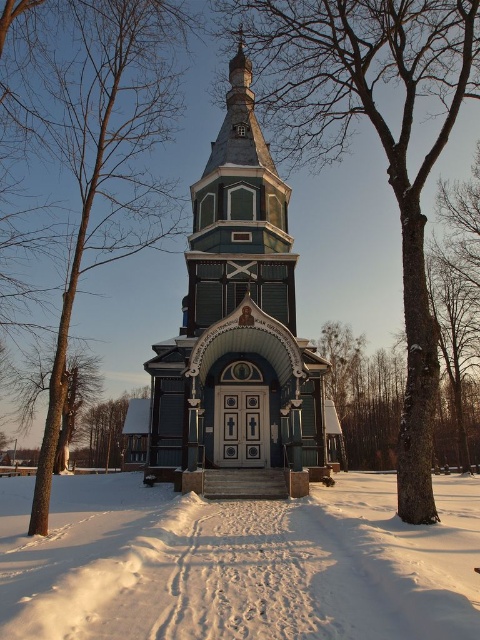
Question: Which point is farther from the camera taking this photo?

Choices:
 (A) (111, 240)
 (B) (327, 44)

Answer: (A)

Question: Is green wood tree at center wider than green wood tree at lower left?

Choices:
 (A) yes
 (B) no

Answer: (A)

Question: Which object is farther from the camera taking this photo?

Choices:
 (A) green wood tree at center
 (B) green wood tree at lower left
 (C) brown wood tree at center

Answer: (B)

Question: Is dark green wood church at center above green wood tree at center?

Choices:
 (A) no
 (B) yes

Answer: (A)

Question: Which of the following is the closest to the observer?

Choices:
 (A) (406, 424)
 (B) (204, 484)
 (C) (132, 420)
 (D) (84, 177)

Answer: (A)

Question: Is green wood tree at center positioned behind brown wood tree at center?

Choices:
 (A) yes
 (B) no

Answer: (B)